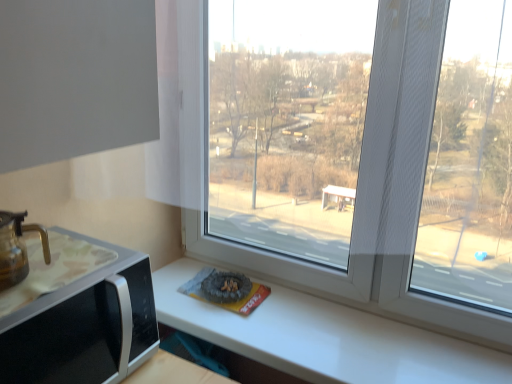
Question: Is translucent glass coffeepot at lower left situated inside black plastic microwave at lower left or outside?

Choices:
 (A) outside
 (B) inside

Answer: (A)

Question: From a real-world perspective, is translucent glass coffeepot at lower left above or below black plastic microwave at lower left?

Choices:
 (A) above
 (B) below

Answer: (A)

Question: From the image's perspective, is translucent glass coffeepot at lower left located above or below black plastic microwave at lower left?

Choices:
 (A) below
 (B) above

Answer: (B)

Question: Is point (136, 294) closer or farther from the camera than point (2, 251)?

Choices:
 (A) closer
 (B) farther

Answer: (B)

Question: Do you think black plastic microwave at lower left is within translucent glass coffeepot at lower left, or outside of it?

Choices:
 (A) inside
 (B) outside

Answer: (B)

Question: Relative to translucent glass coffeepot at lower left, is black plastic microwave at lower left in front or behind?

Choices:
 (A) front
 (B) behind

Answer: (A)

Question: In terms of width, does black plastic microwave at lower left look wider or thinner when compared to translucent glass coffeepot at lower left?

Choices:
 (A) wide
 (B) thin

Answer: (A)